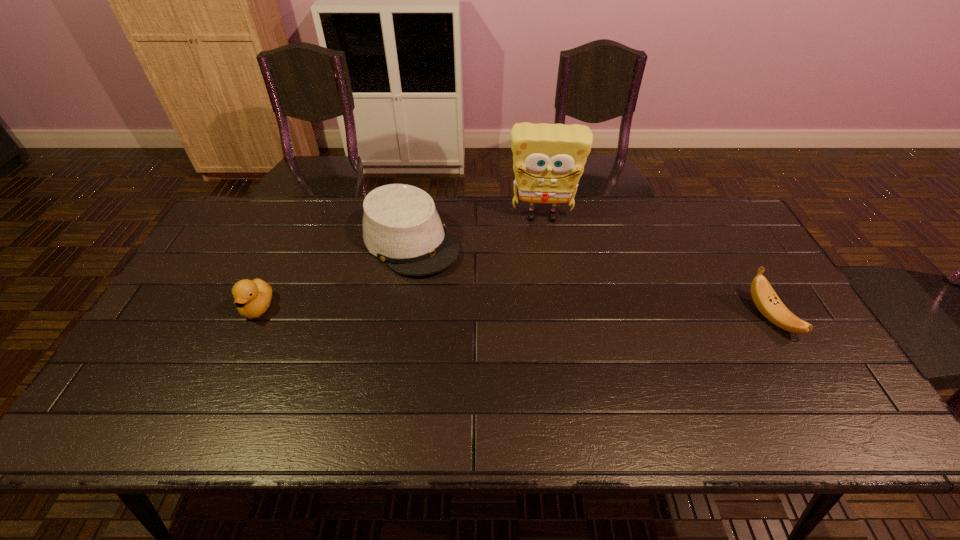
This screenshot has height=540, width=960. Find the location of `duckling`. duckling is located at coordinates (252, 298).

This screenshot has width=960, height=540. In order to click on banana in this screenshot , I will do `click(765, 298)`.

Where is `the second object from left to right`? This screenshot has height=540, width=960. the second object from left to right is located at coordinates (401, 227).

Locate an element on the screen. the second object from right to left is located at coordinates (548, 159).

At what (x,y) coordinates should I click in order to perform the action: click on the tallest object. Please return your answer as a coordinate pair (x, y). Looking at the image, I should click on (548, 159).

Locate an element on the screen. blank space located facing forward on the leftmost object is located at coordinates (218, 397).

At what (x,y) coordinates should I click in order to perform the action: click on blank area located on the front of the rightmost object. Please return your answer as a coordinate pair (x, y). This screenshot has height=540, width=960. Looking at the image, I should click on (816, 397).

The height and width of the screenshot is (540, 960). I want to click on free spot located 0.080m on the front-facing side of the hat, so pos(458,285).

This screenshot has width=960, height=540. Find the location of `vacant space located on the front-facing side of the hat`. vacant space located on the front-facing side of the hat is located at coordinates click(x=488, y=311).

You are a GUI agent. You are given a task and a screenshot of the screen. Output one action in this format:
    pyautogui.click(x=<x>, y=<y>)
    Task: Click on the free space located 0.050m on the front-facing side of the hat
    Image resolution: width=960 pixels, height=540 pixels.
    Given the screenshot: What is the action you would take?
    pyautogui.click(x=451, y=279)